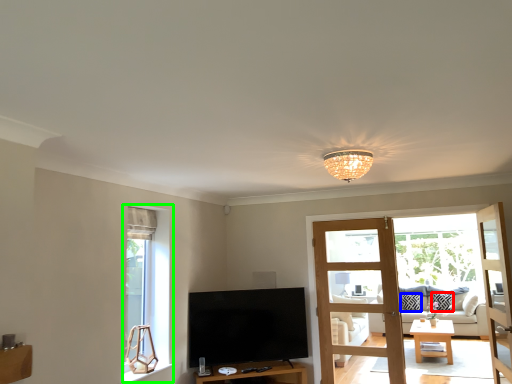
Question: Based on their relative distances, which object is farther from pillow (highlighted by a red box)? Choose from pillow (highlighted by a blue box) and window (highlighted by a green box).

Choices:
 (A) pillow
 (B) window

Answer: (B)